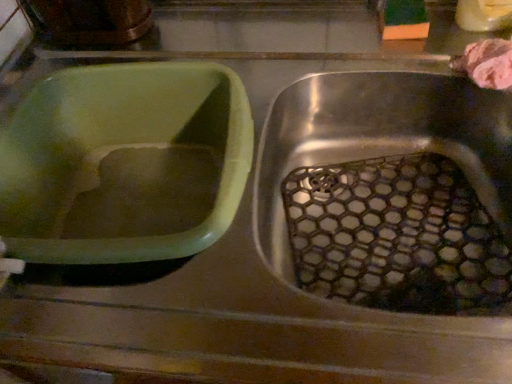
Question: In terms of height, does green plastic basin at left look taller or shorter compared to pink fluffy sponge at upper right?

Choices:
 (A) short
 (B) tall

Answer: (B)

Question: Considering the positions of green plastic basin at left and pink fluffy sponge at upper right in the image, is green plastic basin at left wider or thinner than pink fluffy sponge at upper right?

Choices:
 (A) wide
 (B) thin

Answer: (A)

Question: Is green plastic basin at left inside or outside of pink fluffy sponge at upper right?

Choices:
 (A) inside
 (B) outside

Answer: (B)

Question: From the image's perspective, is pink fluffy sponge at upper right located above or below green plastic basin at left?

Choices:
 (A) below
 (B) above

Answer: (B)

Question: Is point [454, 59] positioned closer to the camera than point [209, 77]?

Choices:
 (A) closer
 (B) farther

Answer: (A)

Question: In terms of height, does pink fluffy sponge at upper right look taller or shorter compared to green plastic basin at left?

Choices:
 (A) short
 (B) tall

Answer: (A)

Question: From a real-world perspective, is pink fluffy sponge at upper right above or below green plastic basin at left?

Choices:
 (A) below
 (B) above

Answer: (B)